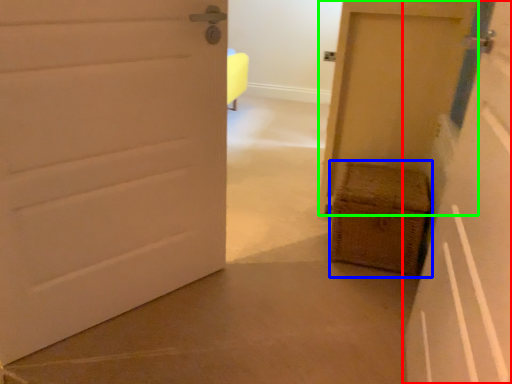
Question: Estimate the real-world distances between objects in this image. Which object is farther from door (highlighted by a red box), basket (highlighted by a blue box) or door (highlighted by a green box)?

Choices:
 (A) basket
 (B) door

Answer: (B)